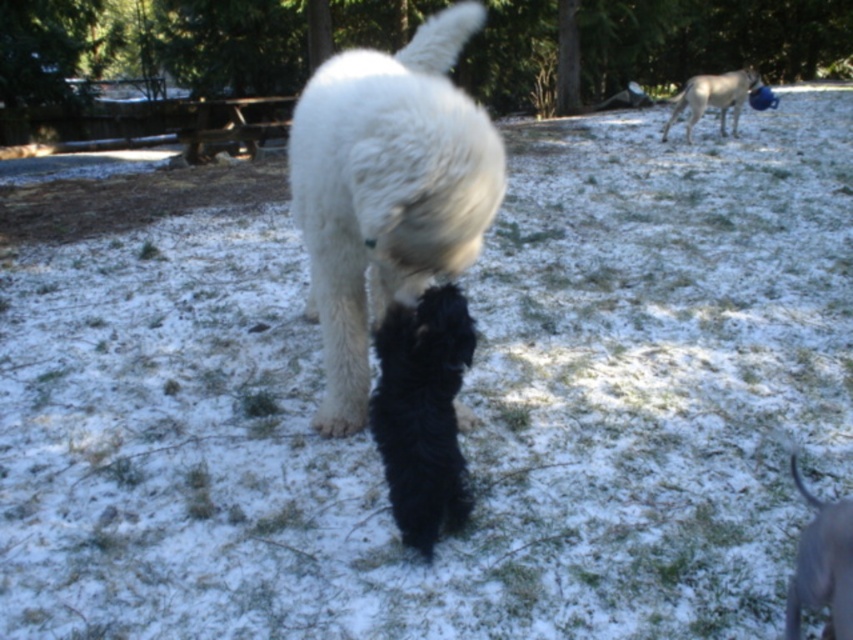
What do you see at coordinates (422, 412) in the screenshot? I see `black fluffy tail at center` at bounding box center [422, 412].

Which of these two, black fluffy tail at center or black silky fur at lower right, stands shorter?

black silky fur at lower right

Is point (418, 460) positioned behind point (791, 589)?

Yes, it is.

Image resolution: width=853 pixels, height=640 pixels. What are the coordinates of `black fluffy tail at center` in the screenshot? It's located at (422, 412).

Is black fluffy tail at center positioned in front of white fur dog at upper right?

That is True.

This screenshot has height=640, width=853. What do you see at coordinates (422, 412) in the screenshot?
I see `black fluffy tail at center` at bounding box center [422, 412].

You are a GUI agent. You are given a task and a screenshot of the screen. Output one action in this format:
    pyautogui.click(x=<x>, y=<y>)
    Task: Click on the black fluffy tail at center
    The image size is (853, 640).
    Given the screenshot: What is the action you would take?
    pyautogui.click(x=422, y=412)

Does black silky fur at lower right come in front of white fur dog at upper right?

That is True.

Measure the distance between point (x=810, y=497) and camera.

1.82 meters

Find the location of a particular element. black silky fur at lower right is located at coordinates (822, 564).